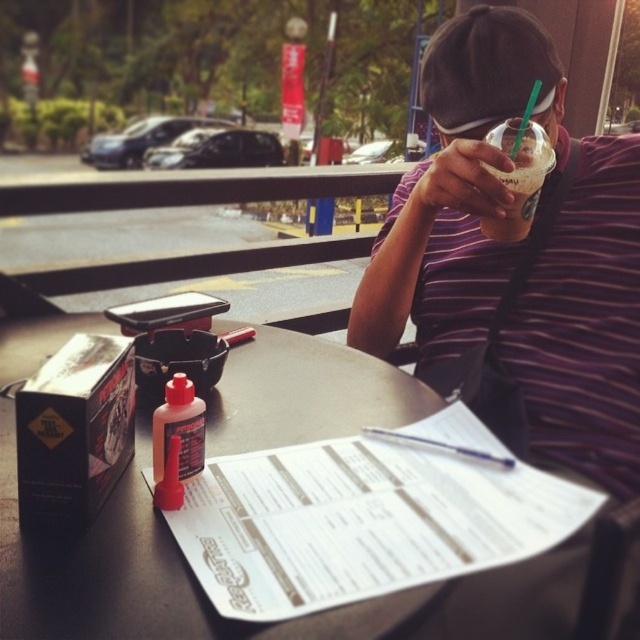
You are a delivery person who needs to leave a package on the table. The package is too big to place between the purple striped shirt at upper right and the translucent plastic cup at upper right. Where should you place it instead?

Since the purple striped shirt at upper right is in front of the translucent plastic cup at upper right, the space between them is limited. To place the large package, you should move it to an area behind the translucent plastic cup at upper right or beside the purple striped shirt at upper right where there is more space available.

You are a delivery person who needs to place a package on the smooth black table at center. However, there is a translucent plastic cup at upper right on the table. Can you place the package on the table without knocking over the cup?

The smooth black table at center is bigger than the translucent plastic cup at upper right, so yes, you can place the package on the table without knocking over the cup as there is enough space.

You are a photographer standing at a distance of 1 meter from the subject. You want to take a closeup shot of the purple striped shirt at upper right. Is the current distance sufficient to capture the shirt clearly?

The purple striped shirt at upper right is 82.36 centimeters from the camera, which is within the 1 meter distance you are standing. Therefore, the current distance is sufficient to capture the shirt clearly.